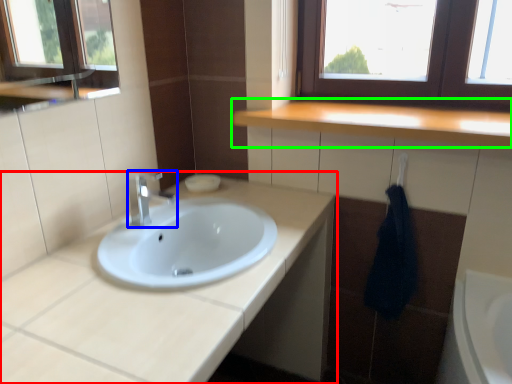
Question: Which is nearer to the bathroom cabinet (highlighted by a red box)? tap (highlighted by a blue box) or countertop (highlighted by a green box).

Choices:
 (A) tap
 (B) countertop

Answer: (A)